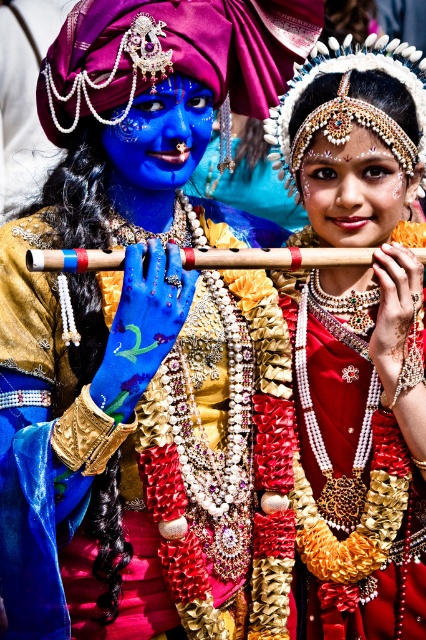
Question: Observing the image, what is the correct spatial positioning of matte gold necklace at center in reference to smooth skin face at center?

Choices:
 (A) left
 (B) right

Answer: (B)

Question: Which point appears closest to the camera in this image?

Choices:
 (A) tap(354, 211)
 (B) tap(167, 108)
 (C) tap(368, 35)

Answer: (B)

Question: Which point is closer to the camera?

Choices:
 (A) wooden flute at center
 (B) purple satin turban at upper left
 (C) blue matte face at center
 (D) shiny gold fabric at center

Answer: (D)

Question: Is matte gold necklace at center to the right of pearl/textured hairpin at upper center from the viewer's perspective?

Choices:
 (A) yes
 (B) no

Answer: (B)

Question: Which object is farther from the camera taking this photo?

Choices:
 (A) pearl/textured hairpin at upper center
 (B) blue matte face at center
 (C) shiny gold fabric at center

Answer: (A)

Question: Can you confirm if pearl/textured hairpin at upper center is positioned to the right of wooden flute at center?

Choices:
 (A) no
 (B) yes

Answer: (B)